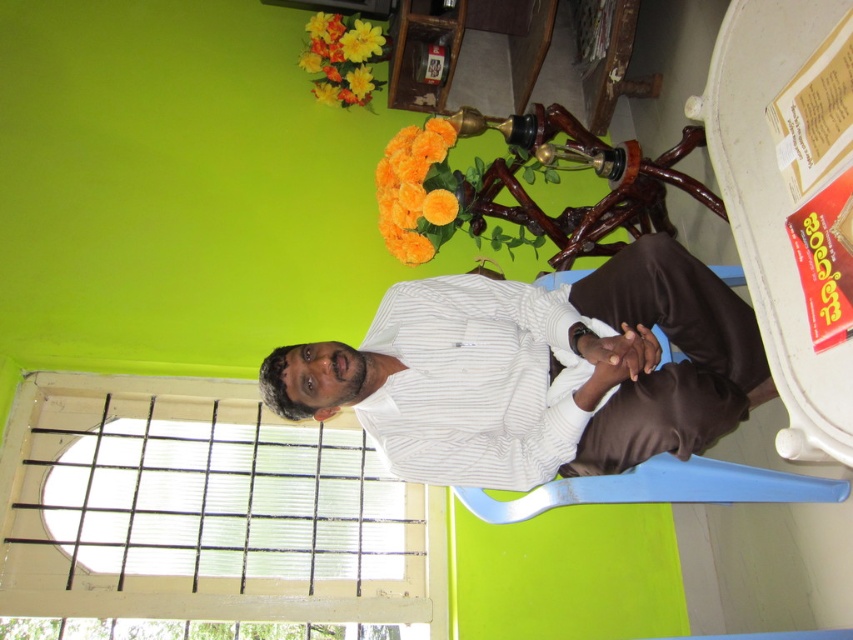
Can you confirm if blue plastic chair at right is positioned above orange matte flowers at center?

Incorrect, blue plastic chair at right is not positioned above orange matte flowers at center.

Is the position of blue plastic chair at right more distant than that of orange matte flowers at center?

No, blue plastic chair at right is closer to the viewer.

Find the location of a particular element. Image resolution: width=853 pixels, height=640 pixels. blue plastic chair at right is located at coordinates (659, 488).

Is point (409, 472) positioned after point (392, 234)?

No.

Does white striped dress shirt at center have a greater width compared to orange matte flowers at center?

Yes.

Find the location of `white striped dress shirt at center`. white striped dress shirt at center is located at coordinates (477, 381).

Which is in front, point (503, 330) or point (352, 97)?

Point (503, 330) is in front.

Is white striped dress shirt at center thinner than orange artificial flowers at upper center?

Incorrect, white striped dress shirt at center's width is not less than orange artificial flowers at upper center's.

Who is more forward, (x=572, y=381) or (x=379, y=58)?

Point (x=572, y=381) is in front.

Find the location of a particular element. white striped dress shirt at center is located at coordinates (477, 381).